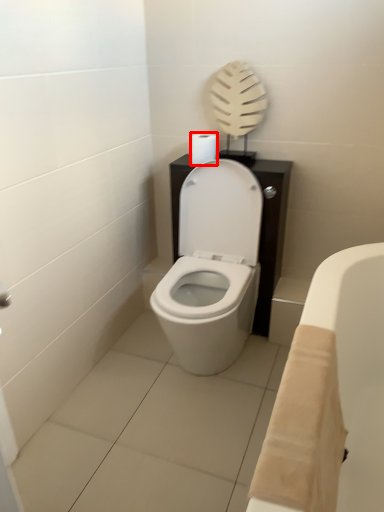
Question: From the image's perspective, where is toilet paper (annotated by the red box) located relative to bath?

Choices:
 (A) below
 (B) above

Answer: (B)